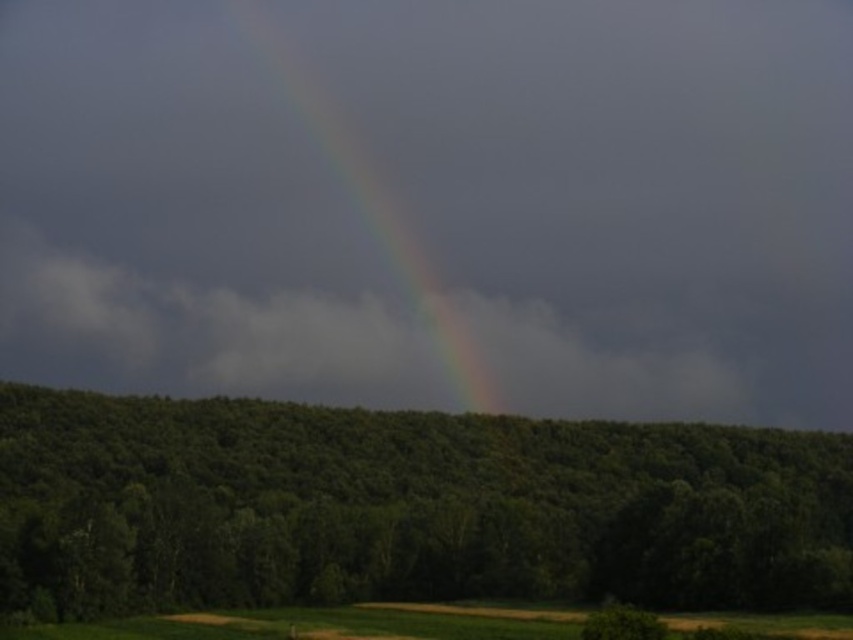
Looking at this image, you are a hiker standing at the base of the green leafy tree at center. You want to cross to the green grassy field at lower center. Can you walk directly to the field without going around the tree?

The green leafy tree at center and green grassy field at lower center are 47.55 meters apart, so yes, you can walk directly to the green grassy field at lower center from the green leafy tree at center since there is a measurable distance between them implying an open path.

You are standing in the forest below the rainbow and want to walk towards the point labeled point (370, 547). As you move forward, will you pass by the point labeled point (456, 323) first?

Since point (370, 547) is in front of point (456, 323), you will reach point (370, 547) before passing point (456, 323). Therefore, you will not pass by point (456, 323) first.